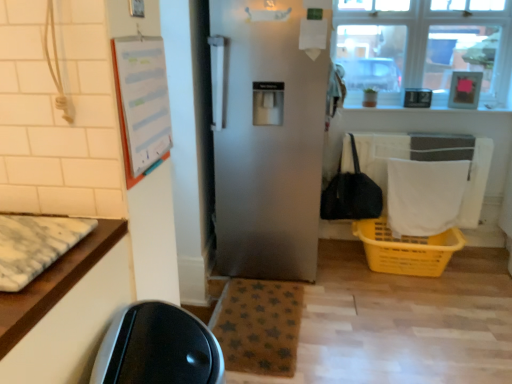
Image resolution: width=512 pixels, height=384 pixels. Identify the location of vacant space in front of yellow plastic basket at lower right. (430, 317).